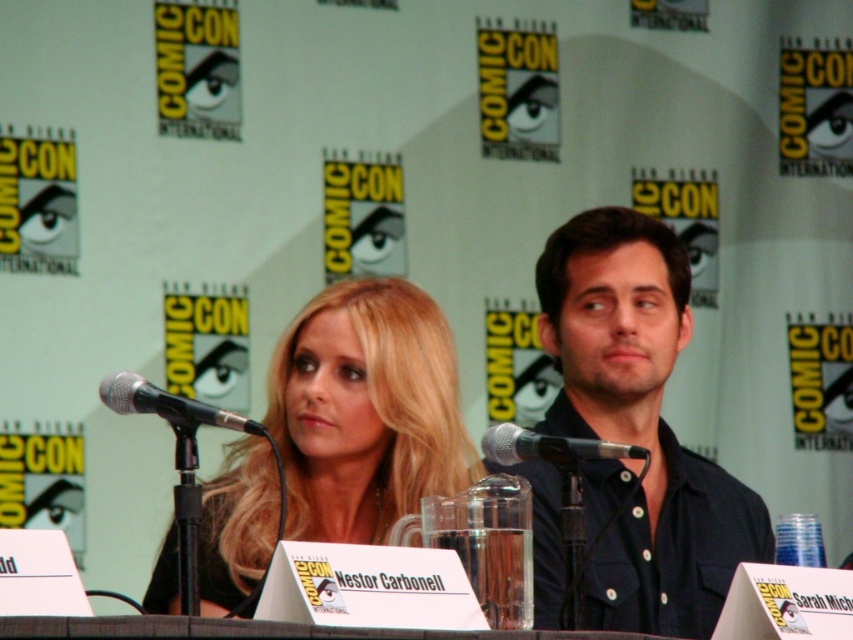
Question: Is blonde hair at center further to the viewer compared to black metallic microphone at center?

Choices:
 (A) no
 (B) yes

Answer: (B)

Question: Which point is farther from the camera taking this photo?

Choices:
 (A) 204,541
 (B) 172,420

Answer: (A)

Question: Estimate the real-world distances between objects in this image. Which object is farther from the dark blue shirt at center?

Choices:
 (A) matte black microphone at center
 (B) transparent glass table at center
 (C) blonde hair at center
 (D) black metallic microphone at center

Answer: (B)

Question: Which point is farther to the camera?

Choices:
 (A) matte black microphone at center
 (B) black metallic microphone at center
 (C) transparent glass table at center
 (D) blonde hair at center

Answer: (D)

Question: In this image, where is dark blue shirt at center located relative to blonde hair at center?

Choices:
 (A) right
 (B) left

Answer: (A)

Question: Can you confirm if dark blue shirt at center is positioned below transparent glass table at center?

Choices:
 (A) no
 (B) yes

Answer: (A)